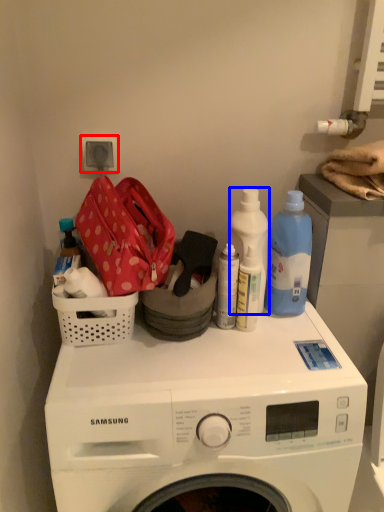
Question: Which object is further to the camera taking this photo, electric outlet (highlighted by a red box) or cleaning product (highlighted by a blue box)?

Choices:
 (A) electric outlet
 (B) cleaning product

Answer: (A)